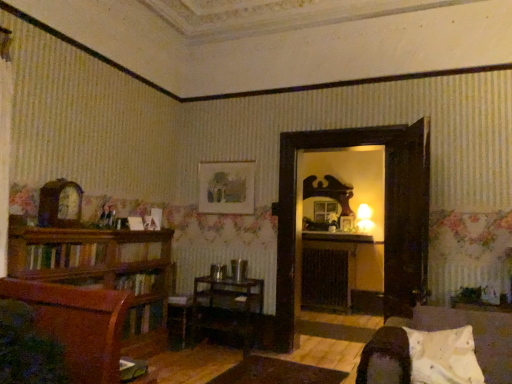
Find the location of `vacant point above matte paper picture frame at upper center (from a real-world perspective)`. vacant point above matte paper picture frame at upper center (from a real-world perspective) is located at coordinates (228, 161).